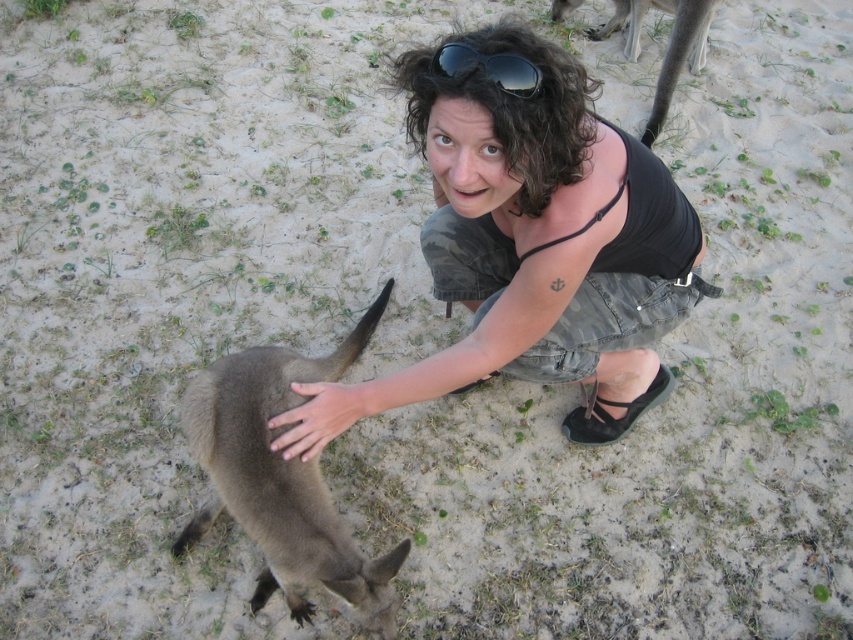
Question: Which point is farther to the camera?

Choices:
 (A) black reflective sunglasses at upper center
 (B) brown fur kangaroo at lower left
 (C) matte black tank top at center
 (D) brown fur at lower right

Answer: (D)

Question: Which object appears closest to the camera in this image?

Choices:
 (A) black reflective sunglasses at upper center
 (B) brown fur kangaroo at lower left
 (C) brown fur at lower right

Answer: (A)

Question: In this image, where is matte black tank top at center located relative to brown fur at lower right?

Choices:
 (A) below
 (B) above

Answer: (A)

Question: Can you confirm if brown fur kangaroo at lower left is positioned to the right of black reflective sunglasses at upper center?

Choices:
 (A) yes
 (B) no

Answer: (B)

Question: Is brown fur kangaroo at lower left positioned before black reflective sunglasses at upper center?

Choices:
 (A) yes
 (B) no

Answer: (B)

Question: Based on their relative distances, which object is nearer to the matte black tank top at center?

Choices:
 (A) black reflective sunglasses at upper center
 (B) brown fur at lower right
 (C) brown fur kangaroo at lower left

Answer: (A)